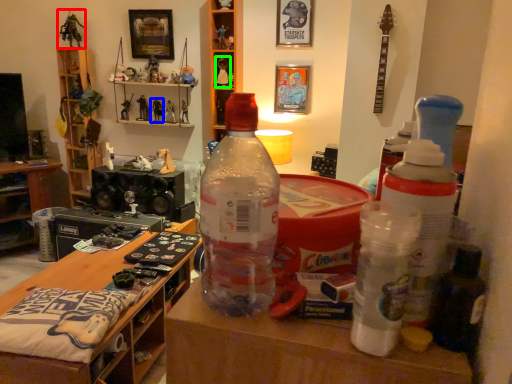
Question: Which is farther away from toy (highlighted by a red box)? toy (highlighted by a blue box) or toy (highlighted by a green box)?

Choices:
 (A) toy
 (B) toy

Answer: (B)